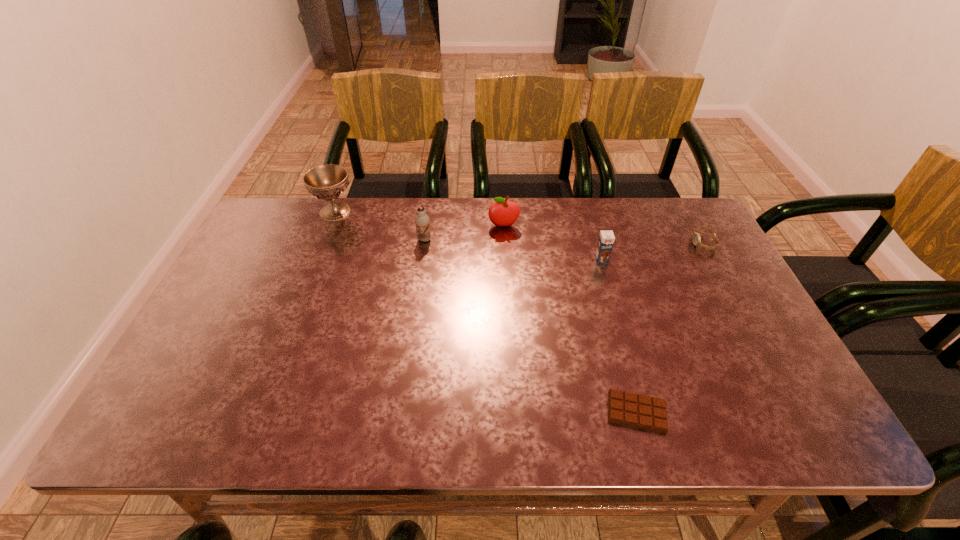
In the image, there is a desktop. Where is `vacant space at the far right corner`? vacant space at the far right corner is located at coordinates tap(683, 222).

Identify the location of free spot between the watch and the farther chocolate milk. Image resolution: width=960 pixels, height=540 pixels. (564, 241).

Locate an element on the screen. free space between the farther chocolate milk and the leftmost object is located at coordinates (380, 226).

You are a GUI agent. You are given a task and a screenshot of the screen. Output one action in this format:
    pyautogui.click(x=<x>, y=<y>)
    Task: Click on the free space between the chalice and the watch
    The image size is (960, 540).
    Given the screenshot: What is the action you would take?
    tap(519, 227)

Image resolution: width=960 pixels, height=540 pixels. What are the coordinates of `vacant region between the leftmost object and the watch` in the screenshot? It's located at (519, 227).

Identify the location of unoccupied position between the second object from left to right and the chalice. (380, 226).

Locate an element on the screen. Image resolution: width=960 pixels, height=540 pixels. vacant area between the shorter chocolate milk and the fourth object from right to left is located at coordinates (552, 243).

Identify which object is the second nearest to the leftmost object. Please provide its 2D coordinates. Your answer should be formatted as a tuple, i.e. [(x, y)], where the tuple contains the x and y coordinates of a point satisfying the conditions above.

[(501, 213)]

Point out which object is positioned as the nearest to the shorter chocolate milk. Please provide its 2D coordinates. Your answer should be formatted as a tuple, i.e. [(x, y)], where the tuple contains the x and y coordinates of a point satisfying the conditions above.

[(501, 213)]

Locate an element on the screen. The image size is (960, 540). vacant region that satisfies the following two spatial constraints: 1. on the front side of the nearest object; 2. on the right side of the fourth object from right to left is located at coordinates (515, 412).